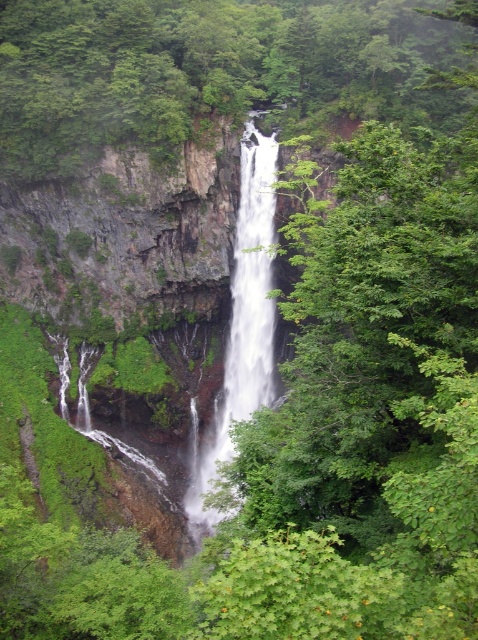
From the picture: You are a hiker standing at the base of the cliff looking up. You see the green leafy tree at center and the white smooth waterfall at center. Which object is higher up on the cliff?

The green leafy tree at center is positioned over the white smooth waterfall at center, so it is higher up on the cliff.